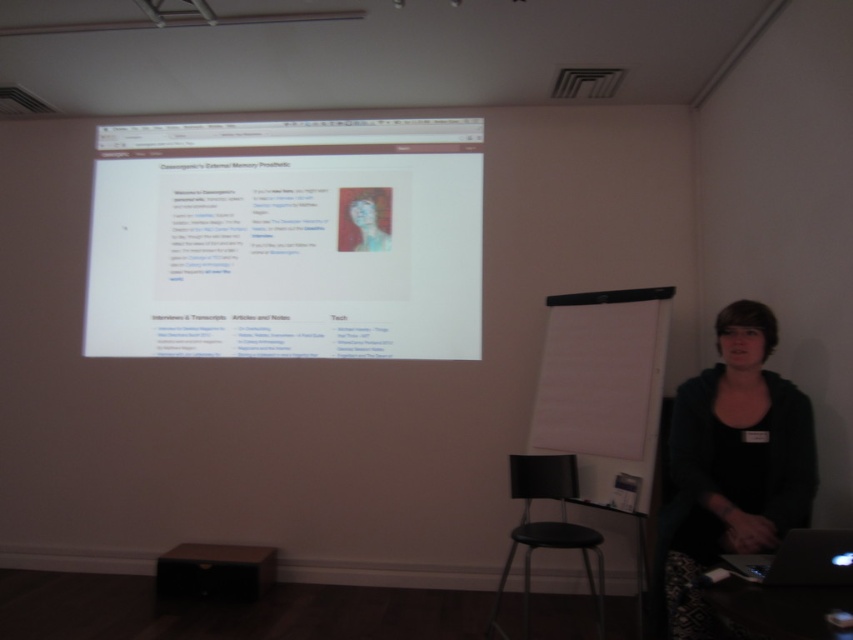
Question: Which point is closer to the camera?

Choices:
 (A) (189, 568)
 (B) (340, 340)
 (C) (827, 548)
 (D) (537, 524)

Answer: (C)

Question: Observing the image, what is the correct spatial positioning of black fabric at lower right in reference to black plastic stool at lower center?

Choices:
 (A) below
 (B) above

Answer: (B)

Question: Estimate the real-world distances between objects in this image. Which object is farther from the brown matte stool at lower center?

Choices:
 (A) black glossy laptop at lower right
 (B) white matte projector screen at upper center

Answer: (A)

Question: Which object appears closest to the camera in this image?

Choices:
 (A) black glossy laptop at lower right
 (B) brown matte stool at lower center
 (C) black fabric at lower right

Answer: (A)

Question: Does white matte projector screen at upper center have a greater width compared to black fabric at lower right?

Choices:
 (A) yes
 (B) no

Answer: (A)

Question: Is black fabric at lower right thinner than brown matte stool at lower center?

Choices:
 (A) no
 (B) yes

Answer: (B)